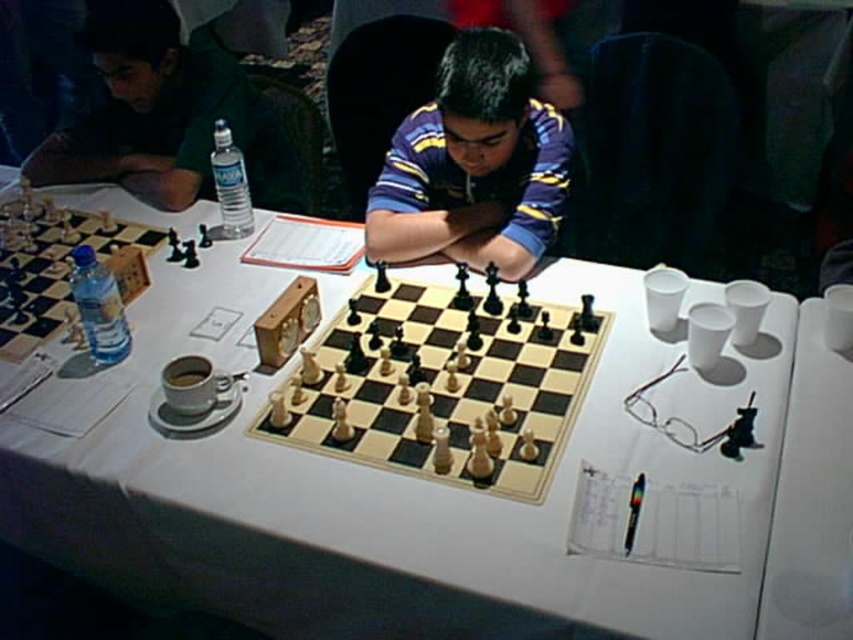
You are a chess player sitting at the table. You want to place your water bottle on the table so it doesn not block the chessboard. Where should you place it relative to the white glossy table at center and the clear plastic bottle at center?

The white glossy table at center is in front of the clear plastic bottle at center, so placing the water bottle behind the clear plastic bottle at center would keep it from blocking the chessboard.

You are a chess player sitting at the table and want to place your queen on the center of the white glossy table at center. Where should you place it?

The white glossy table at center is located at point (x=383, y=492), so you should place the queen at that coordinate.